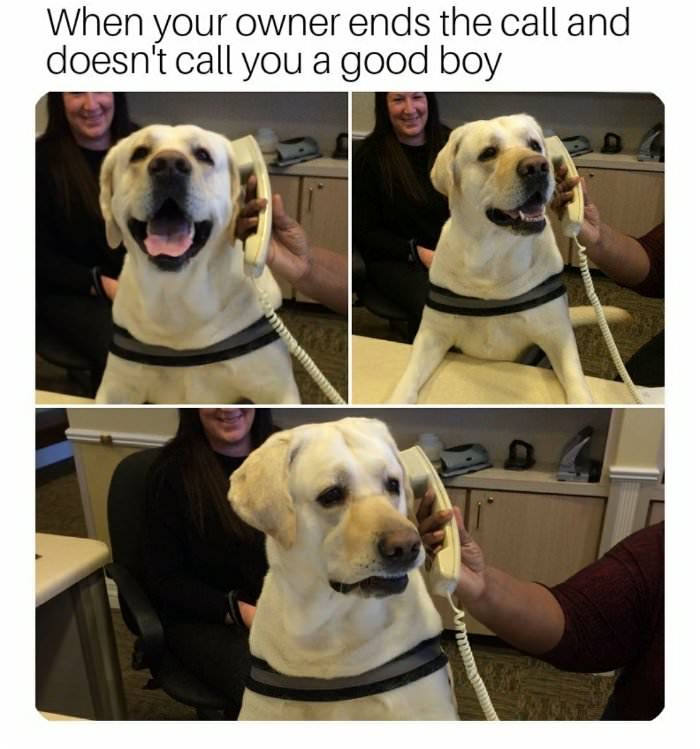
I want to click on desk, so click(x=66, y=564).